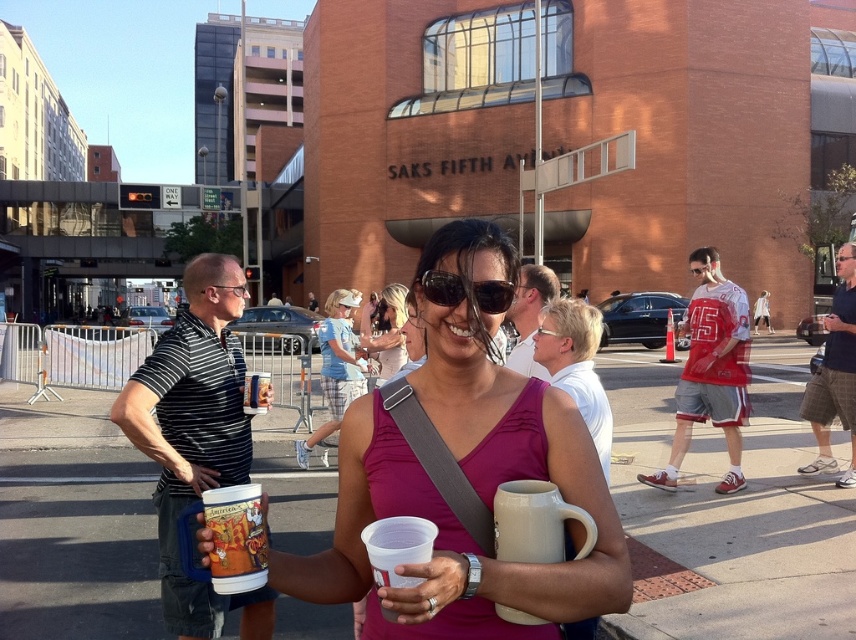
Does smooth concrete pavement at center have a smaller size compared to matte plastic mug at center?

No.

Based on the photo, is smooth concrete pavement at center shorter than matte plastic mug at center?

Incorrect, smooth concrete pavement at center's height does not fall short of matte plastic mug at center's.

Measure the distance between point (639,428) and camera.

Point (639,428) and camera are 10.22 meters apart.

Find the location of a particular element. The image size is (856, 640). smooth concrete pavement at center is located at coordinates (733, 509).

Is matte plastic cup at center below matte red goggles at center?

Yes, matte plastic cup at center is below matte red goggles at center.

The height and width of the screenshot is (640, 856). Describe the element at coordinates (235, 538) in the screenshot. I see `matte plastic cup at center` at that location.

Between point (224, 572) and point (706, 268), which one is positioned behind?

The point (706, 268) is more distant.

This screenshot has width=856, height=640. What are the coordinates of `matte plastic cup at center` in the screenshot? It's located at (235, 538).

Is smooth concrete pavement at center closer to the viewer compared to matte pink tank top at center?

Yes, it is.

Can you confirm if smooth concrete pavement at center is positioned below matte pink tank top at center?

Yes.

Between point (298, 531) and point (378, 308), which one is positioned in front?

Point (298, 531) is more forward.

This screenshot has height=640, width=856. In order to click on smooth concrete pavement at center in this screenshot , I will do `click(733, 509)`.